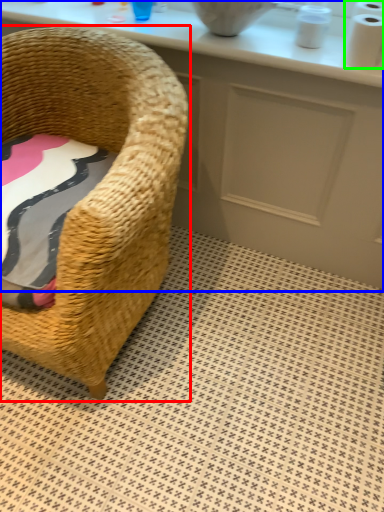
Question: Considering the real-world distances, which object is farthest from chair (highlighted by a red box)? counter (highlighted by a blue box) or toilet paper (highlighted by a green box)?

Choices:
 (A) counter
 (B) toilet paper

Answer: (B)